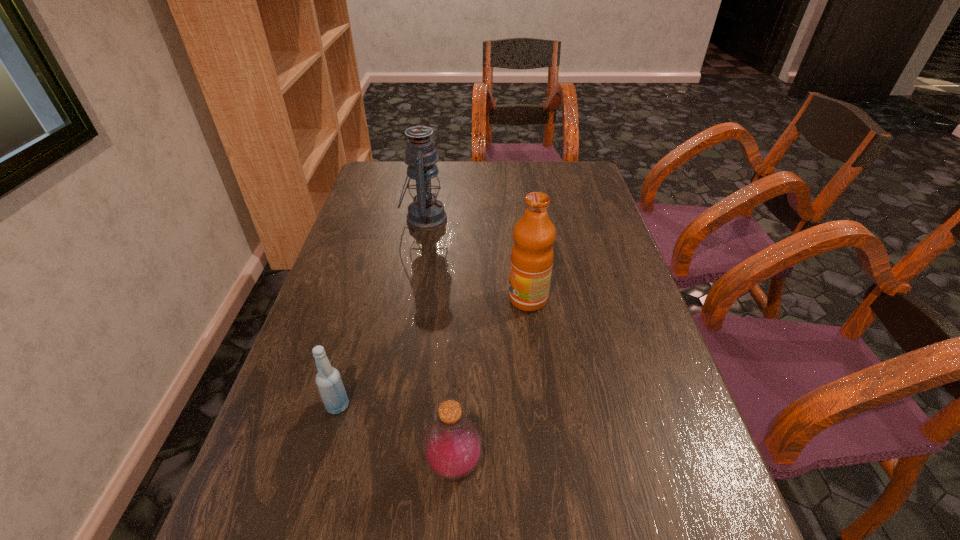
Where is `the third object from right to left`? the third object from right to left is located at coordinates (425, 213).

Identify the location of the farthest object. This screenshot has height=540, width=960. (425, 213).

The height and width of the screenshot is (540, 960). I want to click on fruit juice, so click(532, 254).

Find the location of a particular element. This screenshot has height=540, width=960. the rightmost object is located at coordinates (532, 254).

I want to click on the third object from left to right, so [452, 446].

Identify the location of the right bottle. (452, 446).

Where is `the farther bottle`? The height and width of the screenshot is (540, 960). the farther bottle is located at coordinates (328, 379).

Locate an element on the screen. The height and width of the screenshot is (540, 960). the second nearest object is located at coordinates 328,379.

Find the location of a particular element. The image size is (960, 540). free spot located 0.080m on the front-facing side of the second object from left to right is located at coordinates (473, 219).

You are a GUI agent. You are given a task and a screenshot of the screen. Output one action in this format:
    pyautogui.click(x=<x>, y=<y>)
    Task: Click on the free space located 0.170m on the label side of the third nearest object
    The image size is (960, 540).
    Given the screenshot: What is the action you would take?
    pyautogui.click(x=439, y=299)